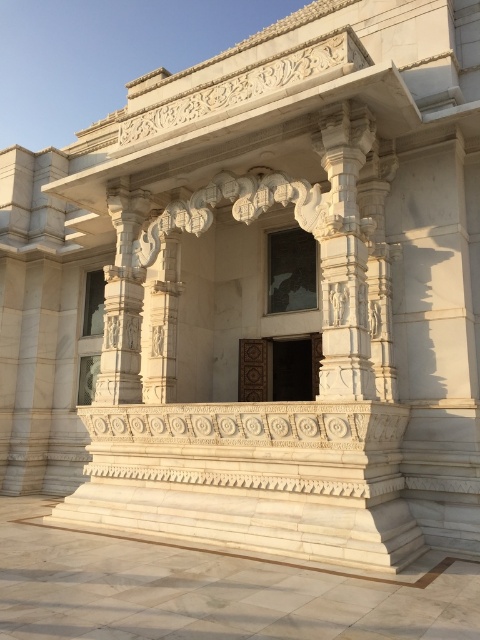
Does white stone column at center have a larger size compared to white carved pillar at center?

Yes, white stone column at center is bigger than white carved pillar at center.

Does white stone column at center have a lesser width compared to white carved pillar at center?

No.

Find the location of a particular element. This screenshot has height=640, width=480. white stone column at center is located at coordinates (344, 256).

You are a GUI agent. You are given a task and a screenshot of the screen. Output one action in this format:
    pyautogui.click(x=<x>, y=<y>)
    Task: Click on the white stone column at center
    The width and height of the screenshot is (480, 640).
    Given the screenshot: What is the action you would take?
    pyautogui.click(x=344, y=256)